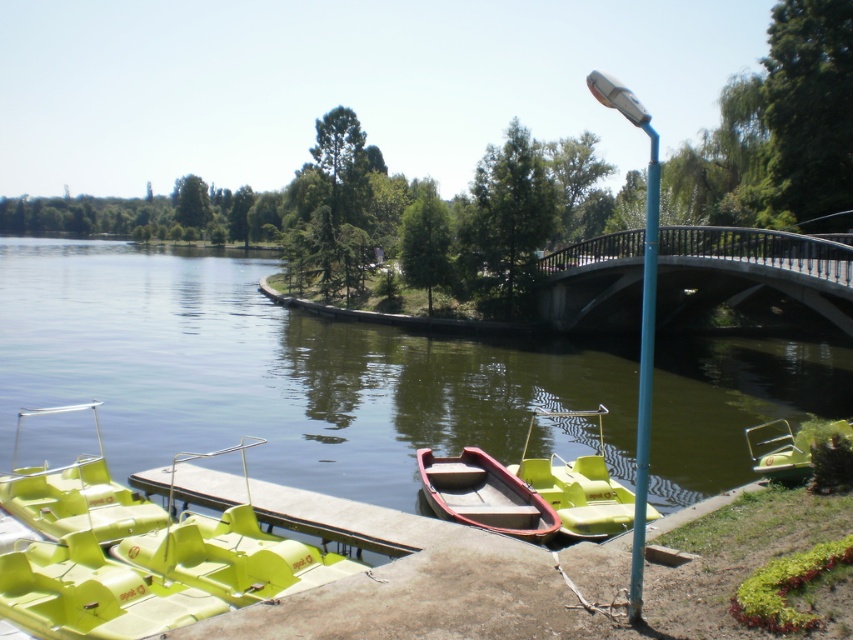
In the scene shown: You are standing at the center of the curved bridge in the middle ground. You want to go to the green plastic boats at lower left. Which direction should you walk? Please answer with a direction like north, south, east, west, northeast, northwest, southeast, or southwest.

Since the green plastic boats at lower left are located at coordinates approximately 0.581 on the x and 0.321 on the y axis, you should walk southeast to reach them from the curved bridge in the middle ground.

You are planning to take a photo of the green plastic boats at lower left and the blue metallic pole at right. Which object should you focus on first if you want to capture both in the same frame without moving the camera?

The green plastic boats at lower left are wider than the blue metallic pole at right, so you should focus on the green plastic boats at lower left first to ensure they fit within the frame.

You are standing at the point with coordinates point [625,276] and want to walk to the point with coordinates point [480,440]. According to the scene description, which direction should you face to move towards your destination?

You should face towards the direction of the pier and the lime green paddle boats because point [480,440] is in front of point [625,276], indicating it is closer to the observer.